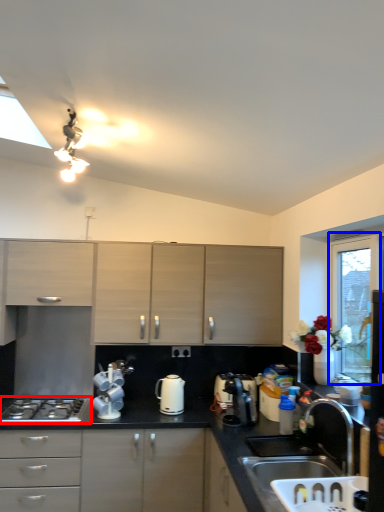
Question: Which point is closer to the camera, gas stove (highlighted by a red box) or window screen (highlighted by a blue box)?

Choices:
 (A) gas stove
 (B) window screen

Answer: (B)